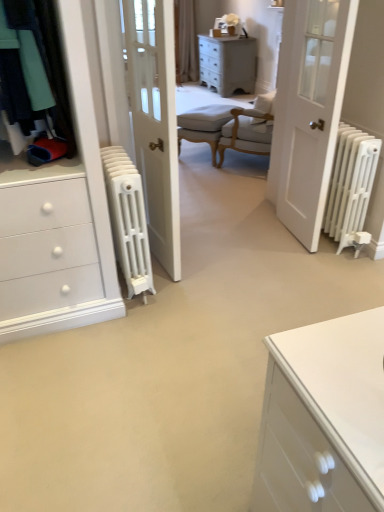
Question: From a real-world perspective, is white matte radiator at right, marked as the second radiator in a left-to-right arrangement, under distressed white chest of drawers at upper center?

Choices:
 (A) no
 (B) yes

Answer: (A)

Question: Can you confirm if white matte radiator at right, marked as the second radiator in a left-to-right arrangement, is smaller than distressed white chest of drawers at upper center?

Choices:
 (A) yes
 (B) no

Answer: (A)

Question: Is distressed white chest of drawers at upper center at the back of white matte radiator at right, marked as the second radiator in a left-to-right arrangement?

Choices:
 (A) no
 (B) yes

Answer: (A)

Question: Considering the relative positions of white matte radiator at right, marked as the second radiator in a left-to-right arrangement, and distressed white chest of drawers at upper center in the image provided, is white matte radiator at right, marked as the second radiator in a left-to-right arrangement, in front of distressed white chest of drawers at upper center?

Choices:
 (A) yes
 (B) no

Answer: (A)

Question: Does white matte radiator at right, marked as the second radiator in a left-to-right arrangement, have a larger size compared to distressed white chest of drawers at upper center?

Choices:
 (A) yes
 (B) no

Answer: (B)

Question: Is distressed white chest of drawers at upper center inside white matte radiator at right, the 1th radiator viewed from the right?

Choices:
 (A) yes
 (B) no

Answer: (B)

Question: Considering the relative positions of white matte radiator at right, the 1th radiator viewed from the right, and light beige fabric armchair at center in the image provided, is white matte radiator at right, the 1th radiator viewed from the right, in front of light beige fabric armchair at center?

Choices:
 (A) no
 (B) yes

Answer: (B)

Question: From a real-world perspective, is white matte radiator at right, the 1th radiator viewed from the right, below light beige fabric armchair at center?

Choices:
 (A) no
 (B) yes

Answer: (A)

Question: From the image's perspective, is white matte radiator at right, the 1th radiator viewed from the right, below light beige fabric armchair at center?

Choices:
 (A) no
 (B) yes

Answer: (B)

Question: Is white matte radiator at right, marked as the second radiator in a left-to-right arrangement, not close to light beige fabric armchair at center?

Choices:
 (A) yes
 (B) no

Answer: (A)

Question: Does white matte radiator at right, marked as the second radiator in a left-to-right arrangement, have a greater height compared to light beige fabric armchair at center?

Choices:
 (A) no
 (B) yes

Answer: (B)

Question: Considering the relative sizes of white matte radiator at right, marked as the second radiator in a left-to-right arrangement, and light beige fabric armchair at center in the image provided, is white matte radiator at right, marked as the second radiator in a left-to-right arrangement, smaller than light beige fabric armchair at center?

Choices:
 (A) yes
 (B) no

Answer: (A)

Question: From a real-world perspective, is beige fabric curtain at upper center over white matte radiator at right, the 1th radiator viewed from the right?

Choices:
 (A) yes
 (B) no

Answer: (A)